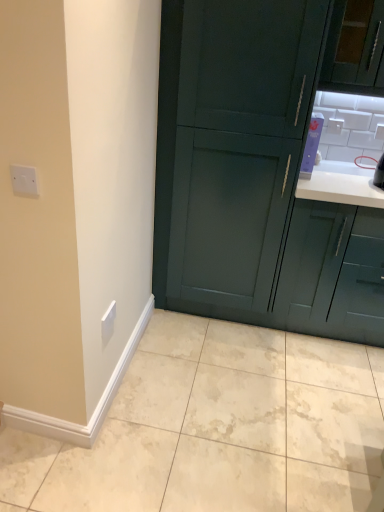
Identify the location of empty space that is ontop of beige marble tile at lower center (from a real-world perspective). [220, 426].